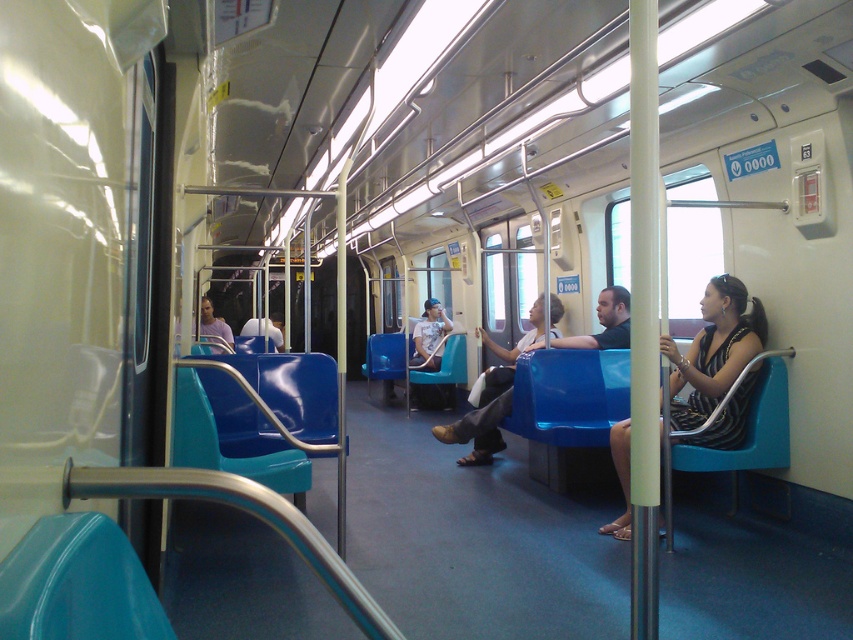
Is point (737, 301) closer to viewer compared to point (454, 435)?

That is True.

Which is below, striped fabric dress at center or matte blue seat at center?

matte blue seat at center is lower down.

Describe the element at coordinates (712, 349) in the screenshot. Image resolution: width=853 pixels, height=640 pixels. I see `striped fabric dress at center` at that location.

Locate an element on the screen. The image size is (853, 640). striped fabric dress at center is located at coordinates (712, 349).